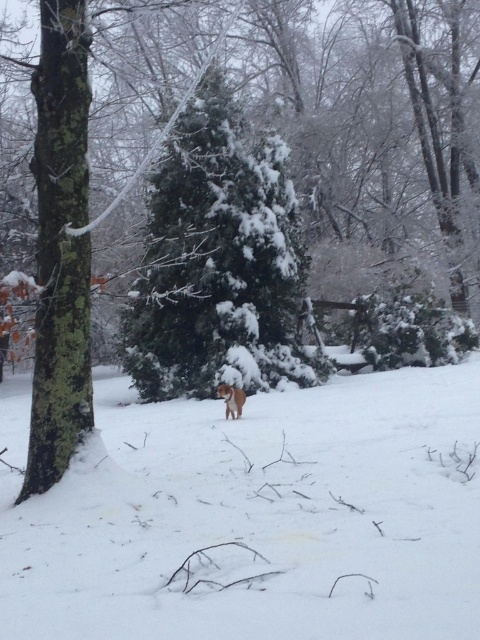
Based on the scene description, where is the point located at coordinates (257, 516)?

The point at coordinates (257, 516) corresponds to the white fluffy snow at center.

You are standing in a winter forest scene. You see a white fluffy snow at center and a green textured evergreen tree at center. Which object is located to the left of the other?

The white fluffy snow at center is positioned on the right side of green textured evergreen tree at center, so the green textured evergreen tree at center is to the left of the white fluffy snow at center.